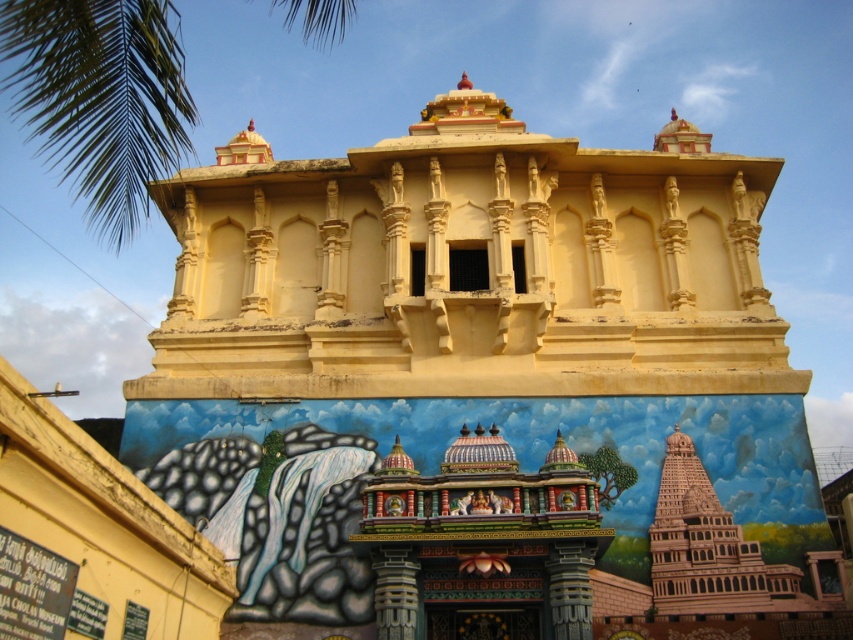
Who is more forward, (257, 262) or (114, 180)?

Point (114, 180) is in front.

What do you see at coordinates (471, 268) in the screenshot? I see `matte yellow hindu temple at center` at bounding box center [471, 268].

This screenshot has height=640, width=853. Find the location of `matte yellow hindu temple at center`. matte yellow hindu temple at center is located at coordinates [471, 268].